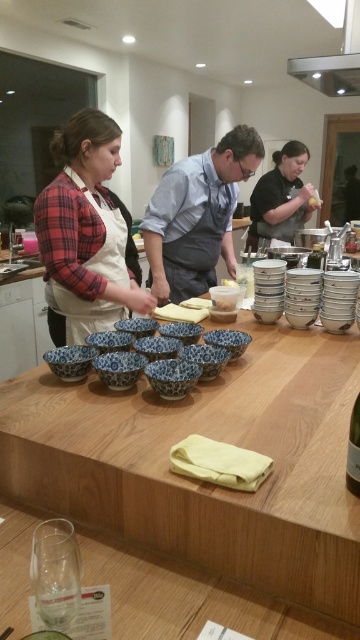
You are a participant in the cooking class and need to choose between the plaid shirt at center and the black matte apron at center for a demonstration. Which item is narrower?

The plaid shirt at center is narrower than the black matte apron at center.

You are a chef preparing a dish and need to place a tall mixing bowl that requires 2 feet of vertical space. You have two options in the image, the wooden table at center and the transparent glass at lower left. Which surface can accommodate the tall mixing bowl based on their heights?

The wooden table at center has a greater height compared to the transparent glass at lower left, so the wooden table at center can accommodate the tall mixing bowl requiring 2 feet of vertical space.

You are a guest in the kitchen and need to locate the blue cotton apron at center. According to the scene, where should you look relative to the transparent glass at lower left?

The blue cotton apron at center is to the right of the transparent glass at lower left.